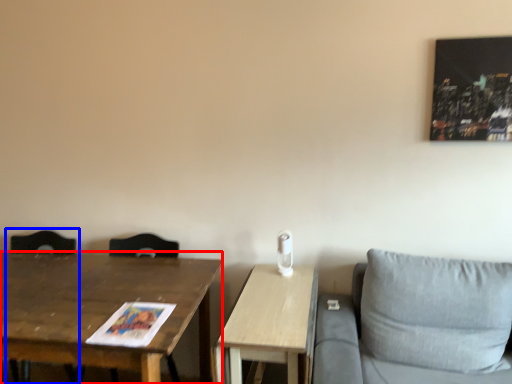
Question: Among these objects, which one is nearest to the camera, table (highlighted by a red box) or swivel chair (highlighted by a blue box)?

Choices:
 (A) table
 (B) swivel chair

Answer: (A)